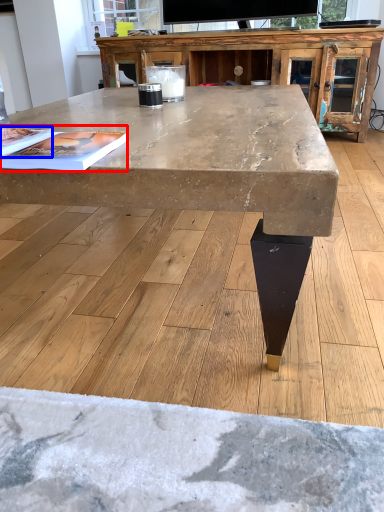
Question: Which object is closer to the camera taking this photo, magazine (highlighted by a red box) or magazine (highlighted by a blue box)?

Choices:
 (A) magazine
 (B) magazine

Answer: (A)